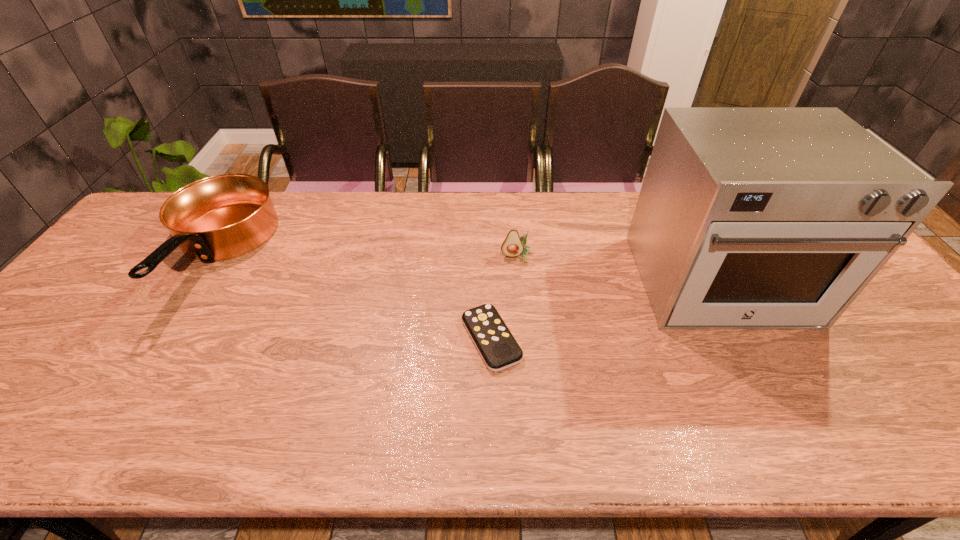
This screenshot has height=540, width=960. In order to click on the rightmost object in this screenshot , I will do `click(749, 218)`.

Locate an element on the screen. This screenshot has width=960, height=540. toaster oven is located at coordinates (749, 218).

Where is `the leftmost object`? The width and height of the screenshot is (960, 540). the leftmost object is located at coordinates (220, 217).

Image resolution: width=960 pixels, height=540 pixels. I want to click on the second tallest object, so click(x=220, y=217).

At what (x,y) coordinates should I click in order to perform the action: click on avocado. Please return your answer as a coordinate pair (x, y). Looking at the image, I should click on (513, 245).

Find the location of a particular element. This screenshot has height=540, width=960. the shortest object is located at coordinates (499, 350).

Where is `vacant area situated on the front panel of the tallest object`? This screenshot has width=960, height=540. vacant area situated on the front panel of the tallest object is located at coordinates (804, 444).

This screenshot has width=960, height=540. I want to click on free region located 0.230m on the handle side of the frying pan, so click(118, 409).

Identify the location of free location located 0.220m on the seed side of the second shortest object. (524, 322).

Identify the location of vacant area situated on the back of the remote control. (489, 236).